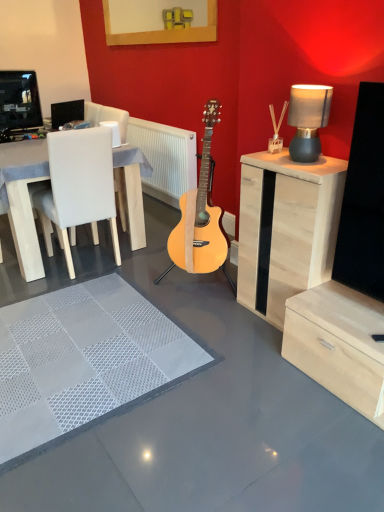
Image resolution: width=384 pixels, height=512 pixels. I want to click on vacant space situated above white textured rug at center (from a real-world perspective), so click(x=79, y=337).